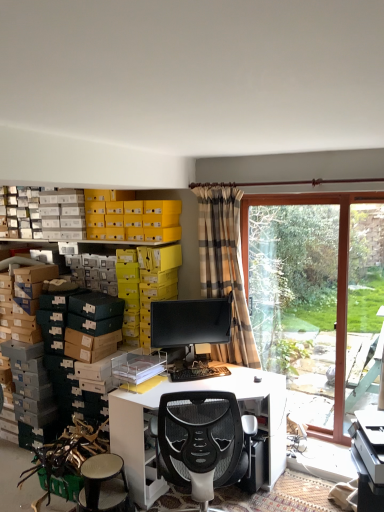
Question: Is white glossy desk at center wider than transparent glass window at right?

Choices:
 (A) yes
 (B) no

Answer: (A)

Question: Is white glossy desk at center facing away from transparent glass window at right?

Choices:
 (A) no
 (B) yes

Answer: (B)

Question: Does white glossy desk at center appear on the left side of transparent glass window at right?

Choices:
 (A) no
 (B) yes

Answer: (B)

Question: From the image's perspective, is white glossy desk at center located beneath transparent glass window at right?

Choices:
 (A) no
 (B) yes

Answer: (B)

Question: From the image's perspective, is white glossy desk at center located above transparent glass window at right?

Choices:
 (A) no
 (B) yes

Answer: (A)

Question: Considering the relative sizes of white glossy desk at center and transparent glass window at right in the image provided, is white glossy desk at center taller than transparent glass window at right?

Choices:
 (A) yes
 (B) no

Answer: (B)

Question: Is transparent glass window at right positioned before black plastic keyboard at center?

Choices:
 (A) no
 (B) yes

Answer: (A)

Question: Can you confirm if transparent glass window at right is taller than black plastic keyboard at center?

Choices:
 (A) yes
 (B) no

Answer: (A)

Question: Does transparent glass window at right have a greater width compared to black plastic keyboard at center?

Choices:
 (A) no
 (B) yes

Answer: (A)

Question: Is transparent glass window at right far away from black plastic keyboard at center?

Choices:
 (A) yes
 (B) no

Answer: (A)

Question: Does transparent glass window at right have a larger size compared to black plastic keyboard at center?

Choices:
 (A) yes
 (B) no

Answer: (A)

Question: Considering the relative sizes of transparent glass window at right and black plastic keyboard at center in the image provided, is transparent glass window at right shorter than black plastic keyboard at center?

Choices:
 (A) yes
 (B) no

Answer: (B)

Question: Is matte black monitor at center not close to white glossy desk at center?

Choices:
 (A) no
 (B) yes

Answer: (A)